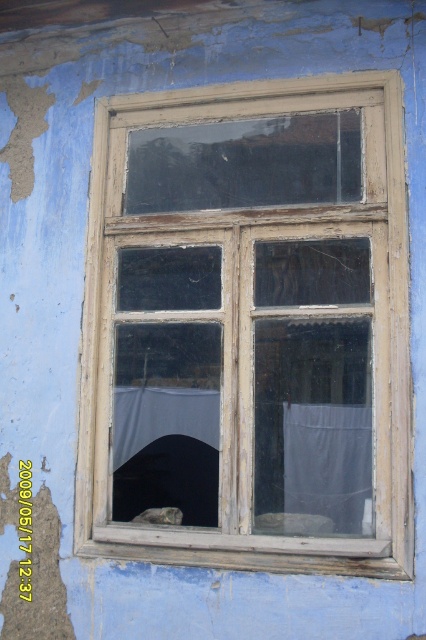
You are standing outside the building and looking at the weathered wood window frame at center and the white sheer curtain at center. Which object is closer to the left edge of the image?

The weathered wood window frame at center is positioned on the left side of white sheer curtain at center, so it is closer to the left edge of the image.

You are an architect planning to install a new window in a building. You have a blueprint showing the window should be placed at coordinates point 0.512, 0.587. Looking at the image of the weathered wood window frame at center, can you confirm if the existing window is already positioned correctly according to the blueprint?

The weathered wood window frame at center is positioned at point (250, 326), so yes, the existing window is already positioned correctly according to the blueprint.